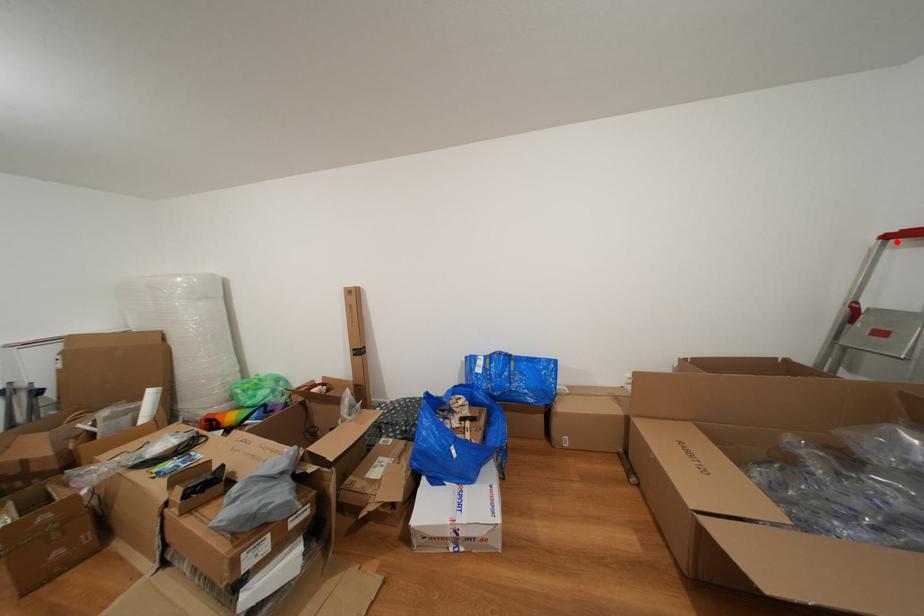
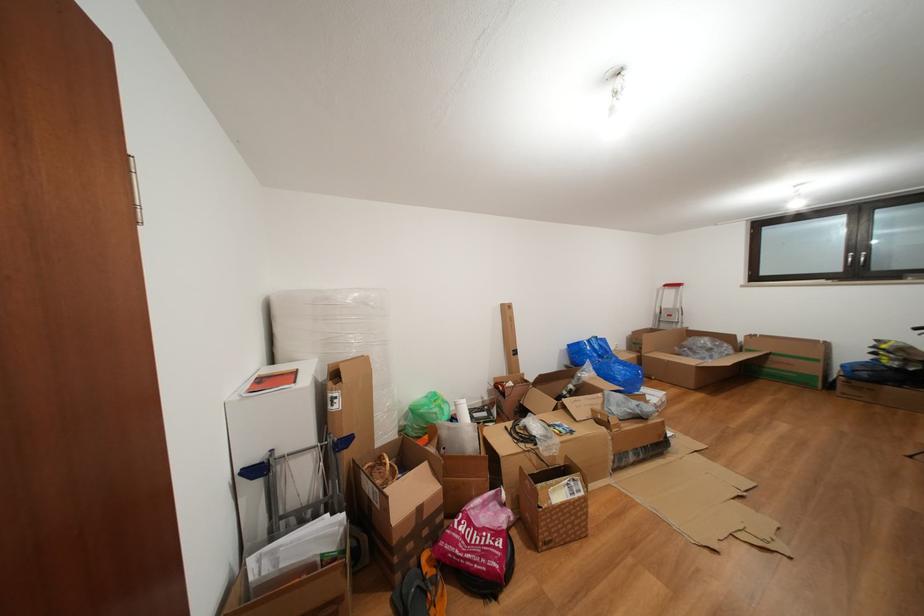
In the second image, find the point that corresponds to the highlighted location in the first image.

(674, 291)